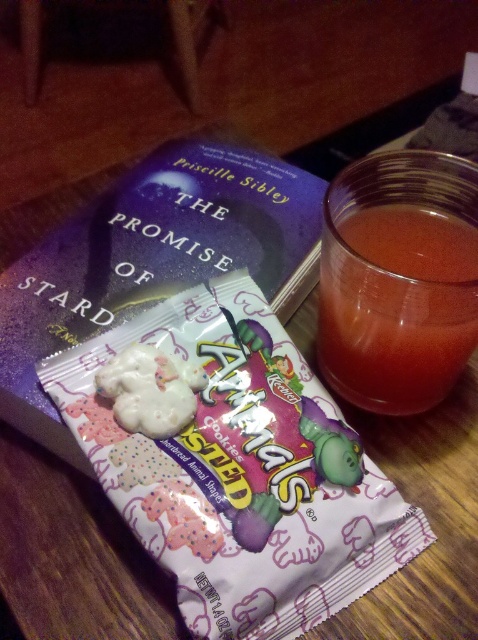
Is purple matte hardcover book at center wider than translucent glass at upper right?

Indeed, purple matte hardcover book at center has a greater width compared to translucent glass at upper right.

Which is behind, point (15, 365) or point (369, 406)?

The point (369, 406) is behind.

This screenshot has width=478, height=640. What are the coordinates of `purple matte hardcover book at center` in the screenshot? It's located at (152, 259).

Is point (448, 221) more distant than point (178, 403)?

Yes, point (448, 221) is farther from viewer.

Between point (406, 225) and point (177, 406), which one is positioned behind?

The point (406, 225) is behind.

The image size is (478, 640). Find the location of `translucent glass at upper right`. translucent glass at upper right is located at coordinates (397, 307).

Can you confirm if white frosted animal cookies at center is shorter than translucent glass at upper right?

No.

Can you confirm if white frosted animal cookies at center is thinner than translucent glass at upper right?

In fact, white frosted animal cookies at center might be wider than translucent glass at upper right.

Does point (195, 630) lie in front of point (360, 275)?

Yes, it is in front of point (360, 275).

Where is `white frosted animal cookies at center`? white frosted animal cookies at center is located at coordinates (237, 467).